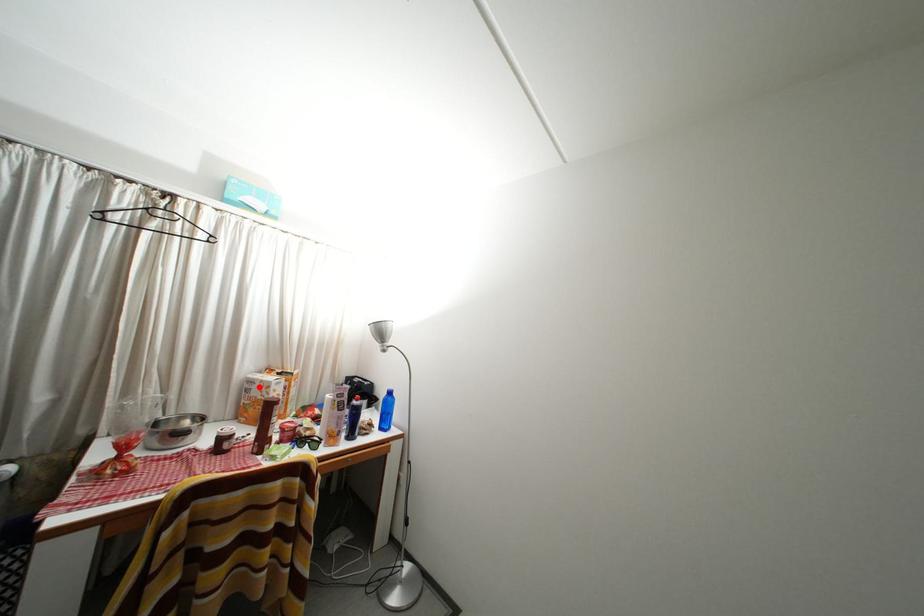
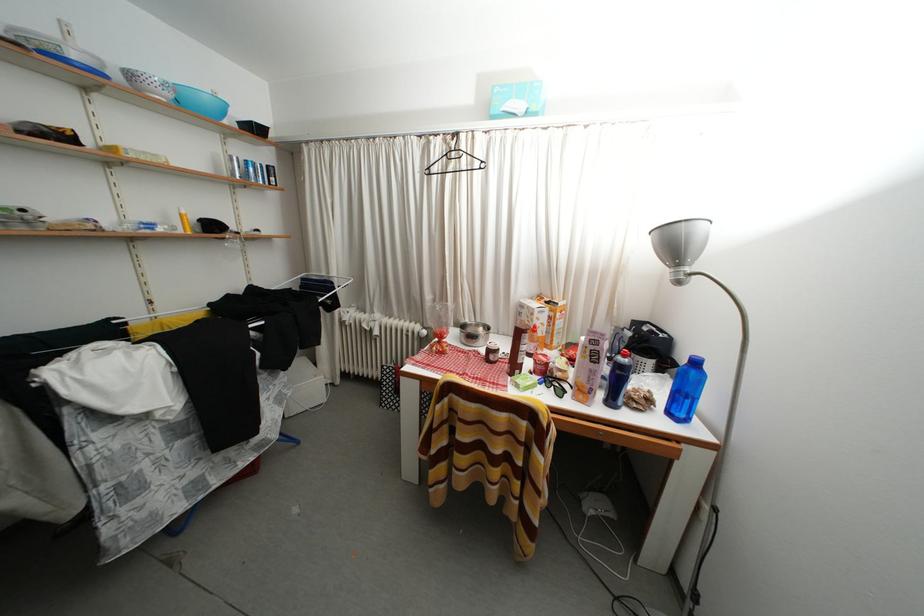
In the second image, find the point that corresponds to the highlighted location in the first image.

(529, 310)